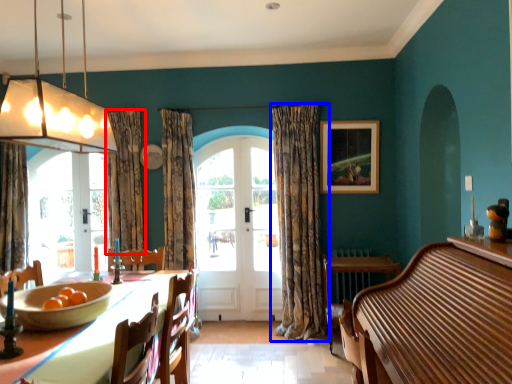
Question: Which point is closer to the camera, curtain (highlighted by a red box) or curtain (highlighted by a blue box)?

Choices:
 (A) curtain
 (B) curtain

Answer: (B)